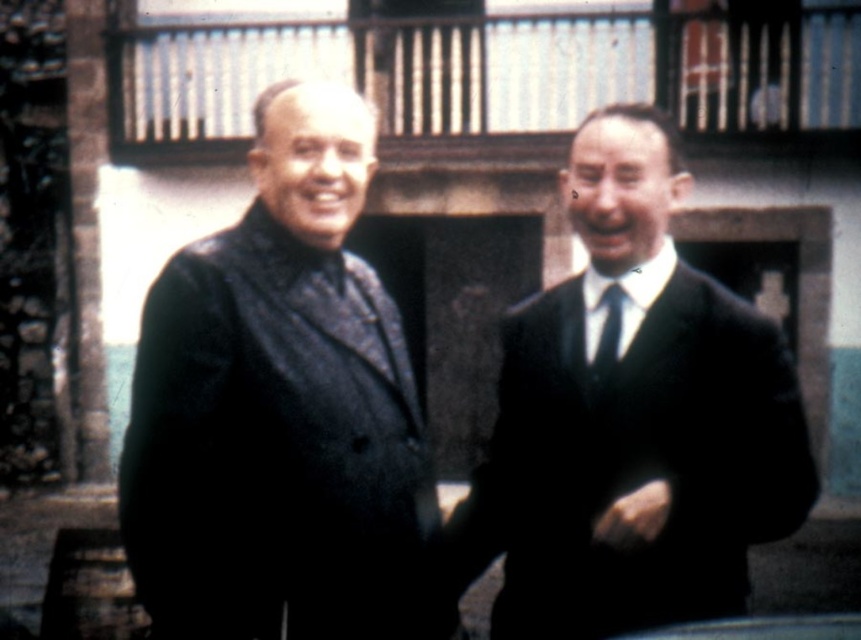
Does matte black coat at left appear on the right side of black silk tie at center?

No, matte black coat at left is not to the right of black silk tie at center.

What do you see at coordinates (282, 412) in the screenshot? I see `matte black coat at left` at bounding box center [282, 412].

Find the location of a particular element. The image size is (861, 640). matte black coat at left is located at coordinates (282, 412).

Who is positioned more to the left, matte black suit at right or black silk tie at center?

Positioned to the left is black silk tie at center.

Between matte black suit at right and black silk tie at center, which one is positioned higher?

black silk tie at center

Between point (770, 422) and point (617, 294), which one is positioned in front?

Point (770, 422)

This screenshot has height=640, width=861. Find the location of `matte black suit at right`. matte black suit at right is located at coordinates (632, 420).

Which is more to the right, matte black coat at left or matte black suit at right?

matte black suit at right

Does matte black coat at left have a greater height compared to matte black suit at right?

No, matte black coat at left is not taller than matte black suit at right.

Is point (342, 349) behind point (725, 515)?

Yes, point (342, 349) is farther from viewer.

Where is `matte black coat at left`? matte black coat at left is located at coordinates (282, 412).